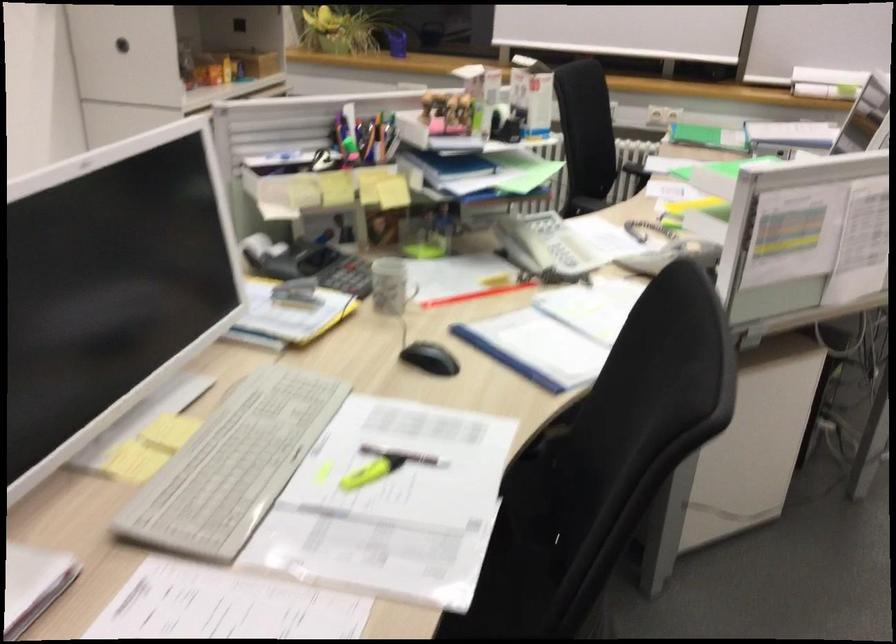
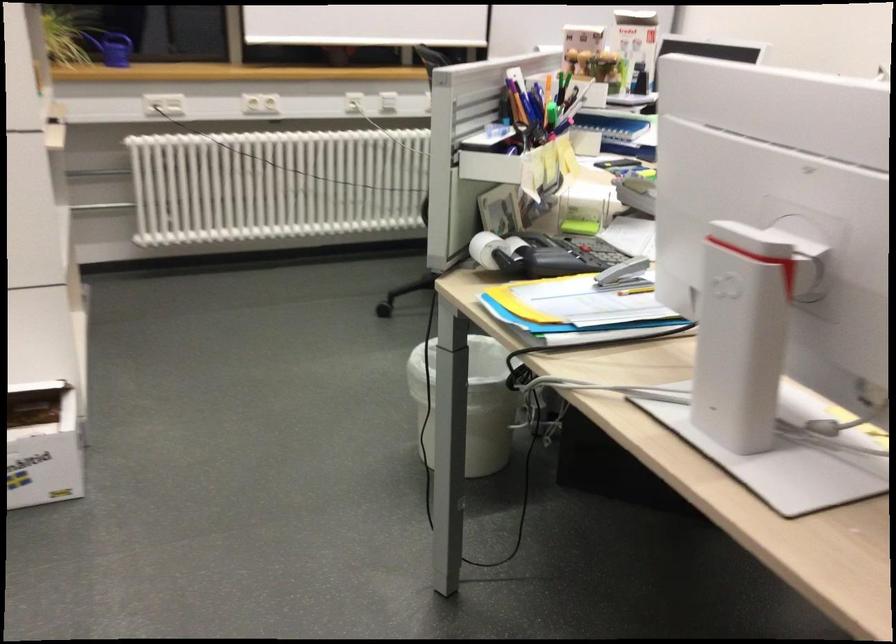
Find the pixel in the second image that matches (x=297, y=295) in the first image.

(624, 275)